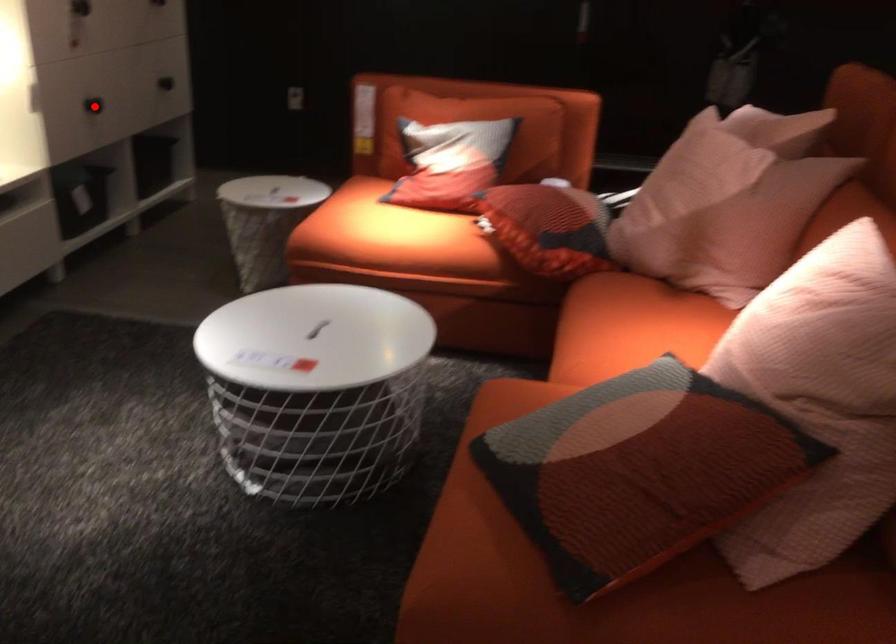
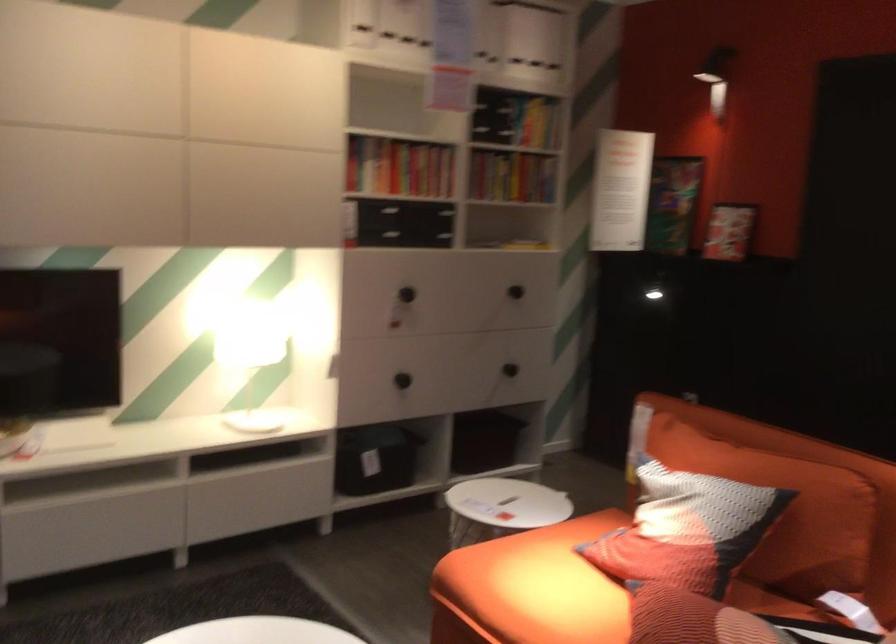
Where in the second image is the point corresponding to the highlighted location from the first image?

(401, 380)